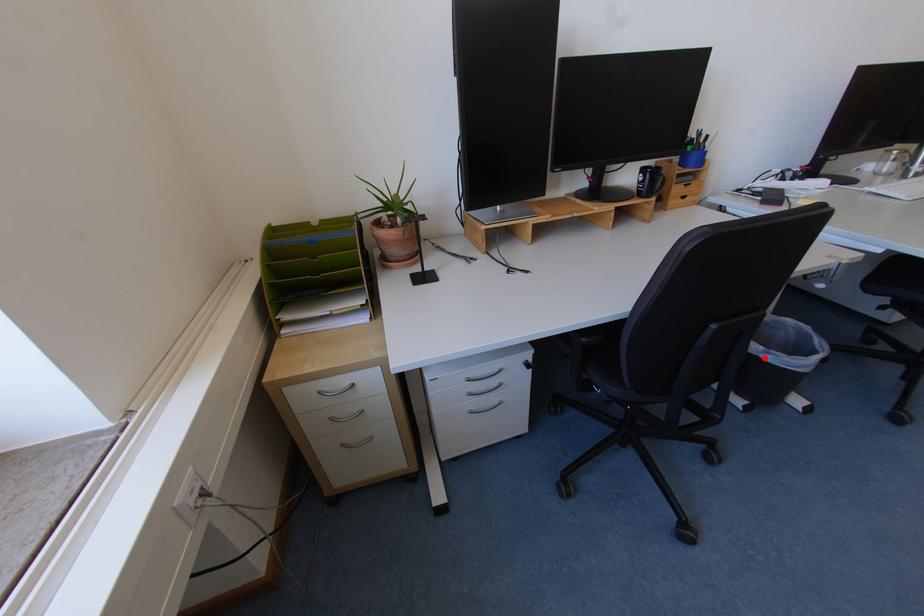
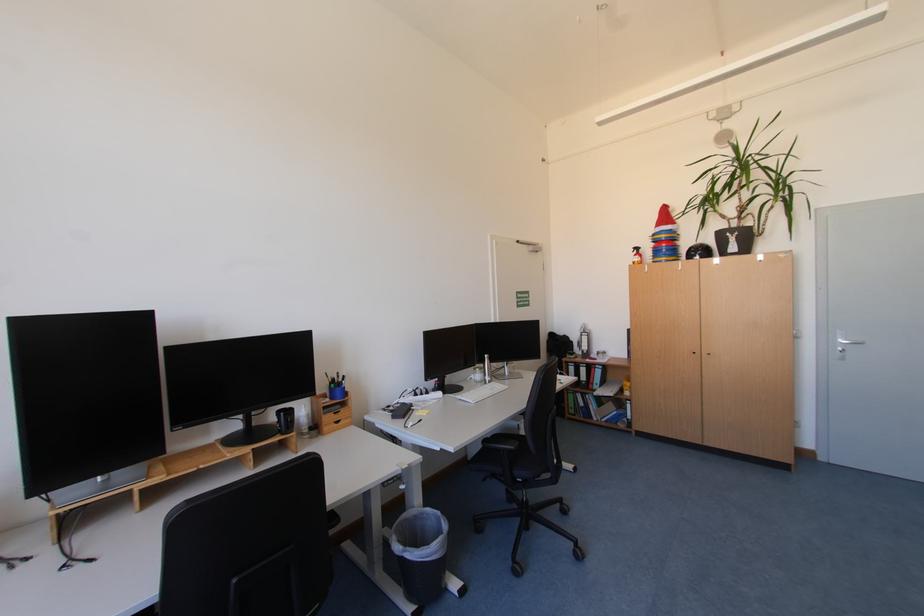
Find the pixel in the second image that matches the highlighted location in the first image.

(409, 557)